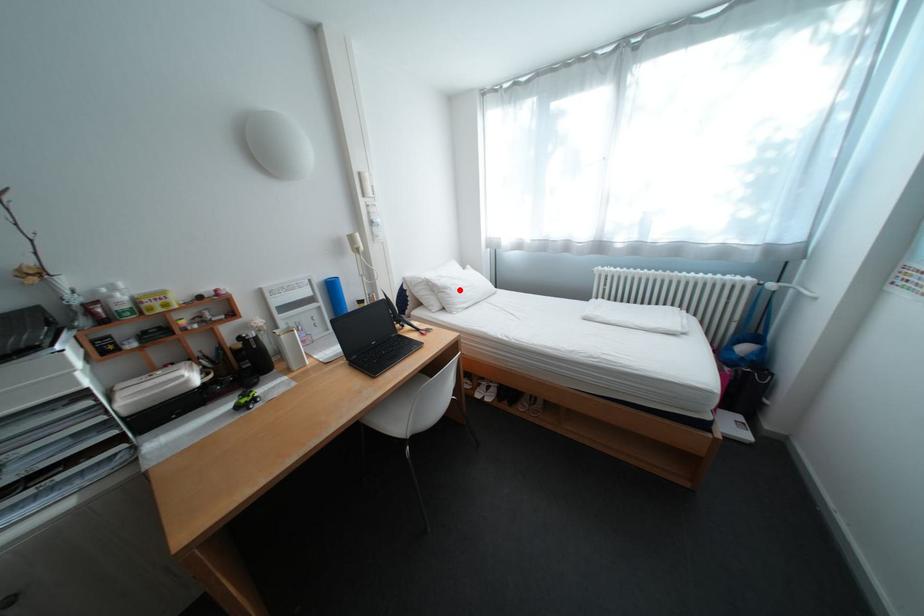
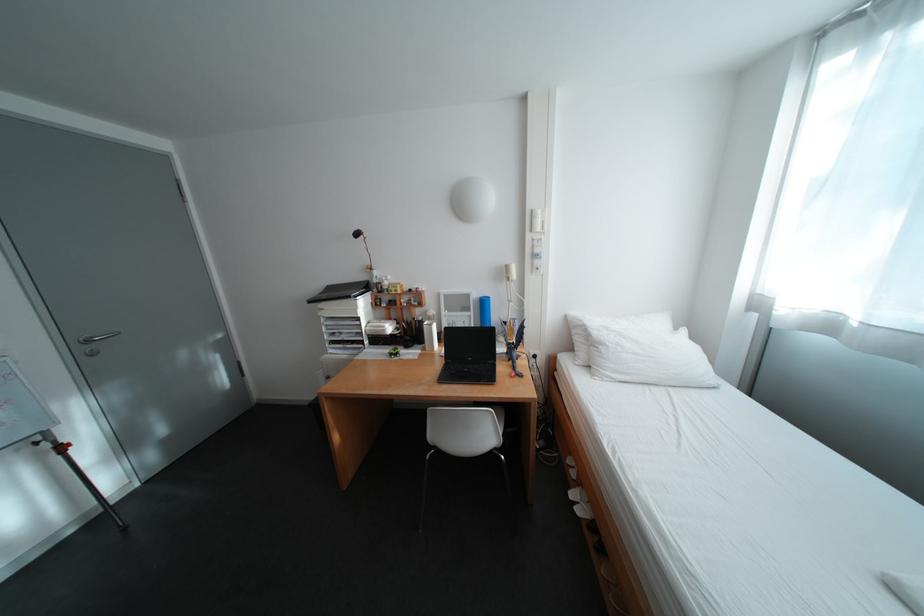
Find the pixel in the second image that matches the highlighted location in the first image.

(614, 346)